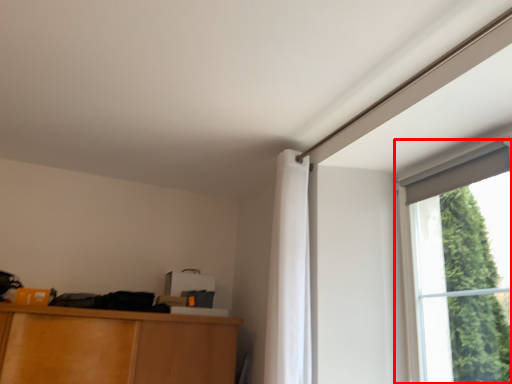
Question: From the image, what is the correct spatial relationship of window (annotated by the red box) in relation to curtain?

Choices:
 (A) left
 (B) right

Answer: (B)